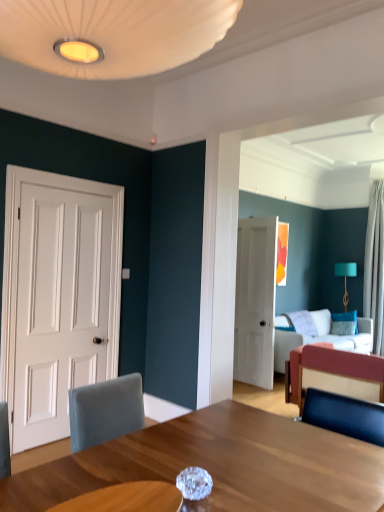
Question: Is white sheer curtain at right shorter than velvet red couch at right?

Choices:
 (A) no
 (B) yes

Answer: (A)

Question: Considering the relative sizes of white sheer curtain at right and velvet red couch at right in the image provided, is white sheer curtain at right wider than velvet red couch at right?

Choices:
 (A) yes
 (B) no

Answer: (B)

Question: Considering the relative sizes of white sheer curtain at right and velvet red couch at right in the image provided, is white sheer curtain at right taller than velvet red couch at right?

Choices:
 (A) no
 (B) yes

Answer: (B)

Question: Is velvet red couch at right completely or partially inside white sheer curtain at right?

Choices:
 (A) no
 (B) yes

Answer: (A)

Question: Is white sheer curtain at right not within velvet red couch at right?

Choices:
 (A) yes
 (B) no

Answer: (A)

Question: Is white sheer curtain at right bigger than velvet red couch at right?

Choices:
 (A) yes
 (B) no

Answer: (A)

Question: Does blue velvet pillow at upper right have a lesser height compared to white sheer curtain at right?

Choices:
 (A) yes
 (B) no

Answer: (A)

Question: Does blue velvet pillow at upper right have a larger size compared to white sheer curtain at right?

Choices:
 (A) yes
 (B) no

Answer: (B)

Question: Considering the relative positions of blue velvet pillow at upper right and white sheer curtain at right in the image provided, is blue velvet pillow at upper right to the left of white sheer curtain at right from the viewer's perspective?

Choices:
 (A) no
 (B) yes

Answer: (B)

Question: Can you confirm if blue velvet pillow at upper right is thinner than white sheer curtain at right?

Choices:
 (A) no
 (B) yes

Answer: (B)

Question: Can you confirm if blue velvet pillow at upper right is smaller than white sheer curtain at right?

Choices:
 (A) no
 (B) yes

Answer: (B)

Question: From a real-world perspective, is blue velvet pillow at upper right located higher than white sheer curtain at right?

Choices:
 (A) yes
 (B) no

Answer: (B)

Question: Are velvet fabric couch at center and white matte door at left, the 1th door viewed from the left, far apart?

Choices:
 (A) yes
 (B) no

Answer: (A)